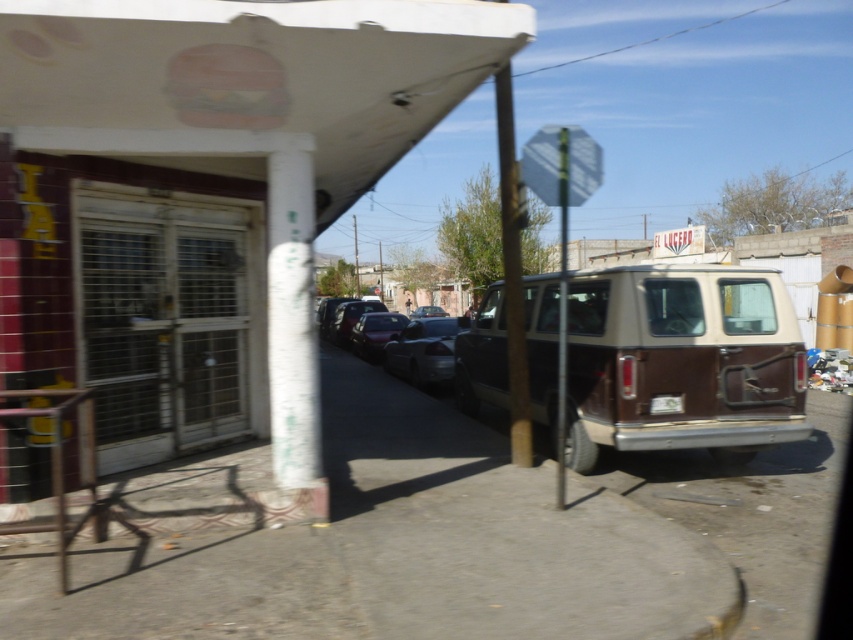
Question: Is brown matte van at center above shiny silver sedan at center?

Choices:
 (A) no
 (B) yes

Answer: (A)

Question: Is satin black sedan at center bigger than metallic pole at center?

Choices:
 (A) yes
 (B) no

Answer: (B)

Question: Based on their relative distances, which object is farther from the glossy metallic car at center?

Choices:
 (A) shiny black sedan at center
 (B) satin black sedan at center
 (C) brown matte van at center

Answer: (C)

Question: Which of these objects is positioned closest to the brown matte van at center?

Choices:
 (A) satin black sedan at center
 (B) shiny silver sedan at center
 (C) metallic pole at center

Answer: (C)

Question: Among these points, which one is nearest to the camera?

Choices:
 (A) (660, 396)
 (B) (380, 349)
 (C) (445, 314)

Answer: (A)

Question: Can you confirm if satin black sedan at center is bigger than glossy metallic car at center?

Choices:
 (A) yes
 (B) no

Answer: (A)